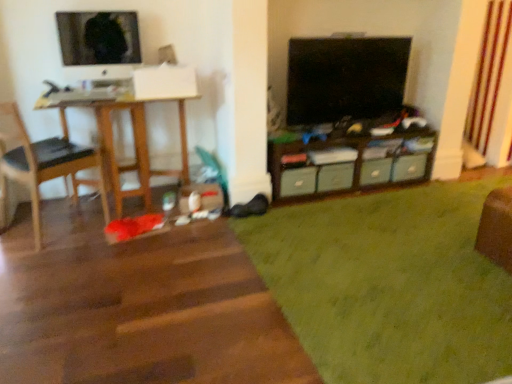
Locate an element on the screen. Image resolution: width=512 pixels, height=384 pixels. vacant space in front of wooden desk at left is located at coordinates (114, 261).